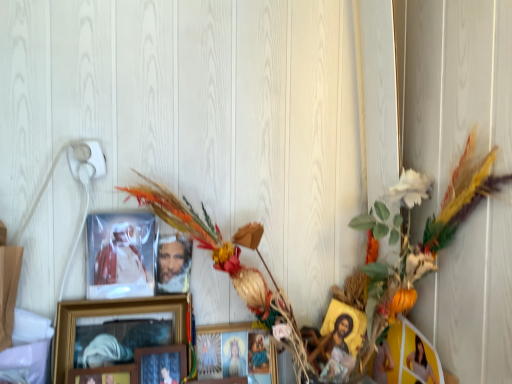
Question: Is matte yellow photo frame at right, marked as the fifth picture frame in a left-to-right arrangement, looking in the opposite direction of wooden framed picture at center, the second picture frame viewed from the left?

Choices:
 (A) yes
 (B) no

Answer: (B)

Question: Does matte yellow photo frame at right, marked as the fifth picture frame in a left-to-right arrangement, appear on the right side of wooden framed picture at center, which is counted as the fourth picture frame, starting from the right?

Choices:
 (A) yes
 (B) no

Answer: (A)

Question: Is matte yellow photo frame at right, the first picture frame viewed from the right, not near wooden framed picture at center, the second picture frame viewed from the left?

Choices:
 (A) no
 (B) yes

Answer: (A)

Question: Is matte yellow photo frame at right, the first picture frame viewed from the right, aimed at wooden framed picture at center, which is counted as the fourth picture frame, starting from the right?

Choices:
 (A) no
 (B) yes

Answer: (B)

Question: Is matte yellow photo frame at right, marked as the fifth picture frame in a left-to-right arrangement, further to camera compared to wooden framed picture at center, the second picture frame viewed from the left?

Choices:
 (A) no
 (B) yes

Answer: (A)

Question: Does point tap(93, 369) appear closer or farther from the camera than point tap(177, 370)?

Choices:
 (A) farther
 (B) closer

Answer: (B)

Question: Looking at their shapes, would you say wooden picture frame at lower left, positioned as the first picture frame in left-to-right order, is wider or thinner than matte wooden picture frame at center, acting as the third picture frame starting from the right?

Choices:
 (A) thin
 (B) wide

Answer: (A)

Question: From the image's perspective, relative to matte wooden picture frame at center, acting as the third picture frame starting from the right, is wooden picture frame at lower left, acting as the 5th picture frame starting from the right, above or below?

Choices:
 (A) above
 (B) below

Answer: (B)

Question: Is wooden picture frame at lower left, positioned as the first picture frame in left-to-right order, bigger or smaller than matte wooden picture frame at center, which is the 3th picture frame from left to right?

Choices:
 (A) big
 (B) small

Answer: (B)

Question: From the image's perspective, is matte yellow photo frame at right, the first picture frame viewed from the right, above or below wooden framed picture at center, which is counted as the fourth picture frame, starting from the right?

Choices:
 (A) above
 (B) below

Answer: (B)

Question: Relative to wooden framed picture at center, which is counted as the fourth picture frame, starting from the right, is matte yellow photo frame at right, the first picture frame viewed from the right, in front or behind?

Choices:
 (A) behind
 (B) front

Answer: (B)

Question: From a real-world perspective, is matte yellow photo frame at right, marked as the fifth picture frame in a left-to-right arrangement, physically located above or below wooden framed picture at center, which is counted as the fourth picture frame, starting from the right?

Choices:
 (A) below
 (B) above

Answer: (A)

Question: Would you say matte yellow photo frame at right, the first picture frame viewed from the right, is to the left or to the right of wooden framed picture at center, which is counted as the fourth picture frame, starting from the right, in the picture?

Choices:
 (A) left
 (B) right

Answer: (B)

Question: From the image's perspective, is wooden framed picture at center, the second picture frame viewed from the left, positioned above or below matte wooden picture frame at center, which is the 2th picture frame from right to left?

Choices:
 (A) below
 (B) above

Answer: (B)

Question: Considering the positions of wooden framed picture at center, the second picture frame viewed from the left, and matte wooden picture frame at center, the fourth picture frame in the left-to-right sequence, in the image, is wooden framed picture at center, the second picture frame viewed from the left, taller or shorter than matte wooden picture frame at center, the fourth picture frame in the left-to-right sequence,?

Choices:
 (A) tall
 (B) short

Answer: (B)